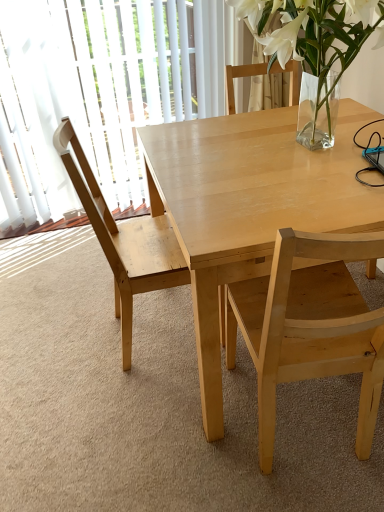
The width and height of the screenshot is (384, 512). Find the location of `vacant region under clear glass vase at upper right (from a real-world perspective)`. vacant region under clear glass vase at upper right (from a real-world perspective) is located at coordinates (296, 147).